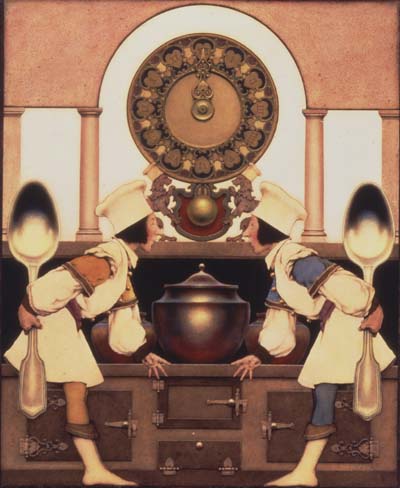
Locate an element on the screen. This screenshot has height=488, width=400. hinge is located at coordinates (156, 416).